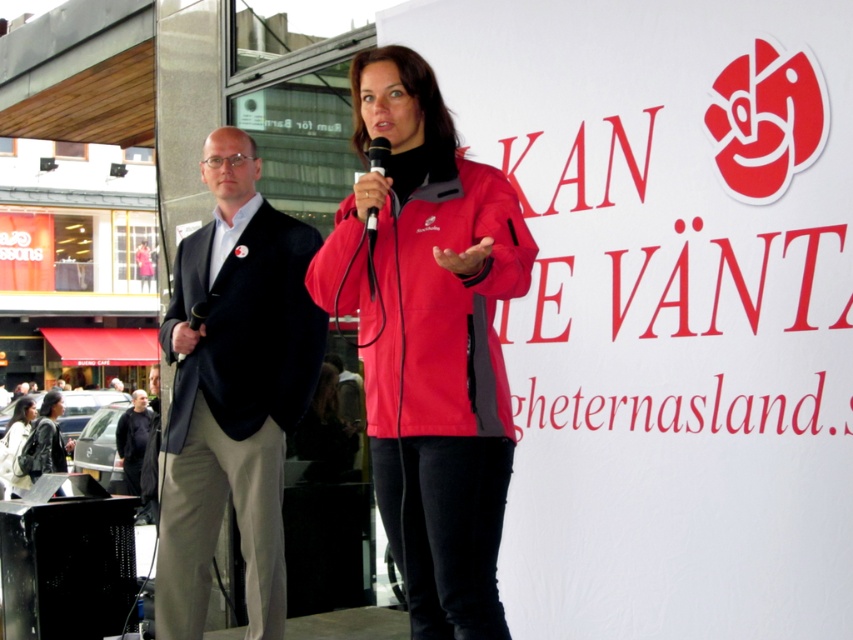
Looking at this image, can you confirm if red softshell jacket at center is positioned below matte black jacket at center?

Incorrect, red softshell jacket at center is not positioned below matte black jacket at center.

Is point (410, 404) farther from viewer compared to point (0, 474)?

No, (410, 404) is in front of (0, 474).

This screenshot has height=640, width=853. Identify the location of red softshell jacket at center. (440, 305).

Who is shorter, black plastic microphone at center or black plastic microphone at left?

Standing shorter between the two is black plastic microphone at left.

Does black plastic microphone at center appear under black plastic microphone at left?

Incorrect, black plastic microphone at center is not positioned below black plastic microphone at left.

The width and height of the screenshot is (853, 640). In order to click on black plastic microphone at center in this screenshot , I will do `click(378, 154)`.

Is point (287, 224) farther from camera compared to point (144, 413)?

No.

Is point (231, 364) positioned after point (120, 419)?

No, (231, 364) is in front of (120, 419).

Locate an element on the screen. black woolen jacket at left is located at coordinates (247, 326).